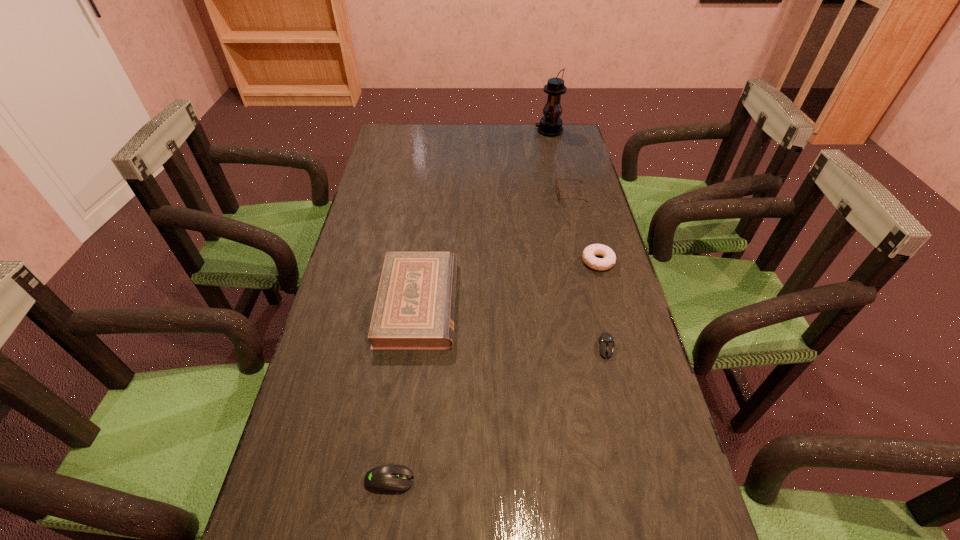
Select a few points in free space located 0.360m above the farthest object, indicating its light source. Please provide its 2D coordinates. Your answer should be formatted as a tuple, i.e. [(x, y)], where the tuple contains the x and y coordinates of a point satisfying the conditions above.

[(445, 131)]

Locate several points within vacant space situated 0.300m above the farthest object, indicating its light source. Please provide its 2D coordinates. Your answer should be formatted as a tuple, i.e. [(x, y)], where the tuple contains the x and y coordinates of a point satisfying the conditions above.

[(461, 131)]

At what (x,y) coordinates should I click in order to perform the action: click on free space located on the lenses of the sunglasses. Please return your answer as a coordinate pair (x, y). This screenshot has height=540, width=960. Looking at the image, I should click on (462, 195).

This screenshot has height=540, width=960. I want to click on vacant region located on the lenses of the sunglasses, so click(438, 195).

Where is `free location located on the lenses of the sunglasses`? This screenshot has width=960, height=540. free location located on the lenses of the sunglasses is located at coordinates (447, 195).

Where is `vacant space located 0.330m on the spine side of the Bible`? vacant space located 0.330m on the spine side of the Bible is located at coordinates (584, 303).

Find the location of `vacant space located 0.180m on the left of the fourth tallest object`. vacant space located 0.180m on the left of the fourth tallest object is located at coordinates (518, 261).

This screenshot has height=540, width=960. Identify the location of vacant point located on the wheel side of the second shortest object. [626, 481].

Find the location of a particular element. vacant space situated 0.270m on the left of the farther computer mouse is located at coordinates (484, 348).

Locate an element on the screen. Image resolution: width=960 pixels, height=540 pixels. object that is at the far edge is located at coordinates (550, 125).